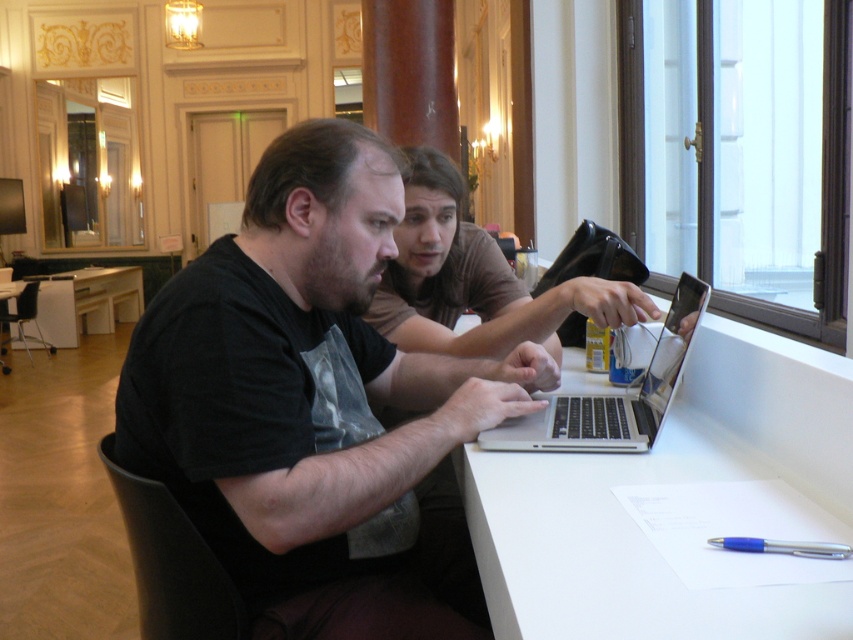
You are standing in the room and want to place a new object at the exact center of the white matte table at center. What coordinates should you use?

The coordinates for the exact center of the white matte table at center are at point (666,481).

You are standing in the room and want to place a small vase on the white matte table at center. However, there is a brown casual shirt at center nearby. Which object should you approach first to place the vase?

You should approach the white matte table at center first because it is closer to you than the brown casual shirt at center, so you can place the vase there without needing to move around the shirt.

You are planning to place a large rectangular board game on the white matte table at center. Considering the brown casual shirt at center is already occupying space on the table, can the board game fit on the table?

The white matte table at center is wider than the brown casual shirt at center, so there should be enough space to place the large rectangular board game on the white matte table at center after considering the space taken by the brown casual shirt at center.